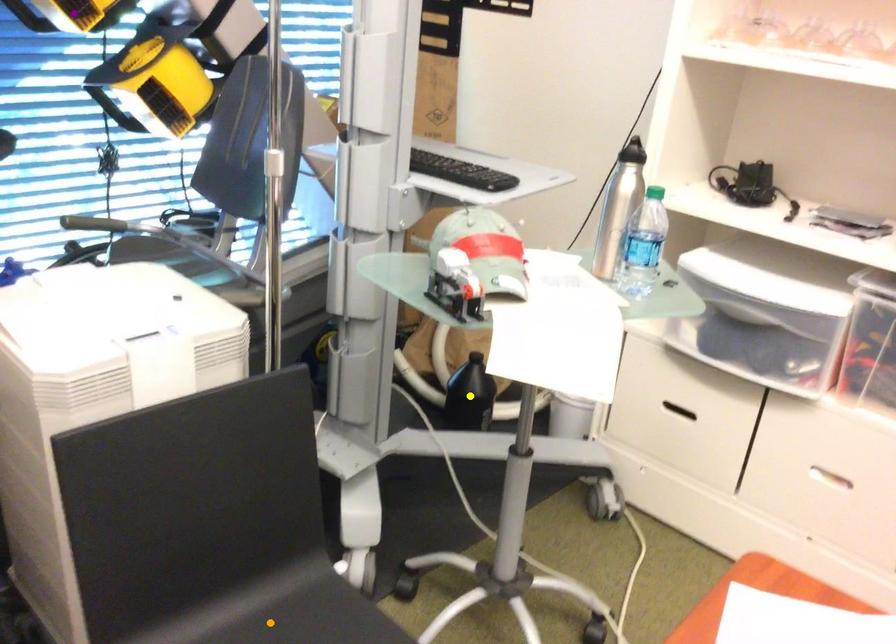
In the scene shown: Order these from nearest to farthest:
yellow point
purple point
orange point

orange point, purple point, yellow point